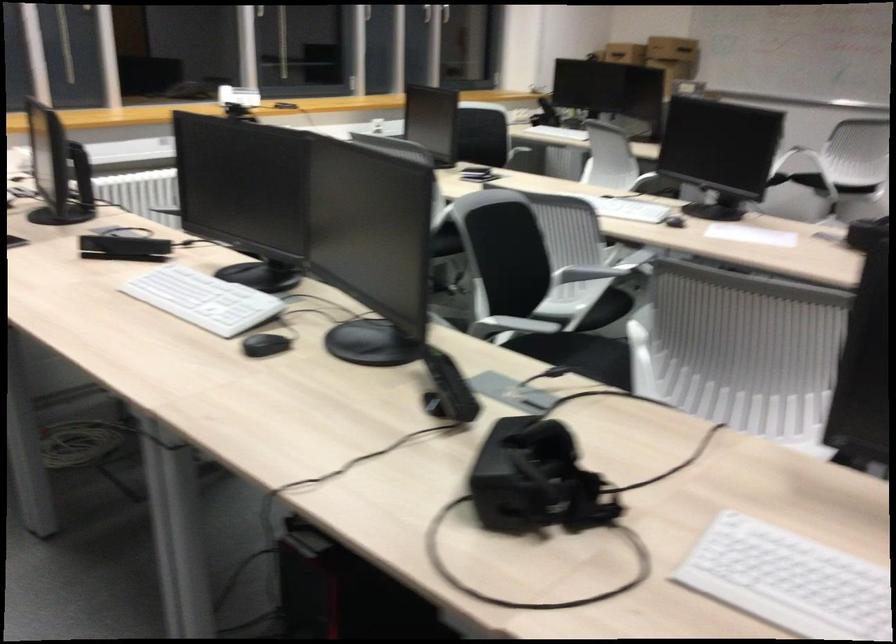
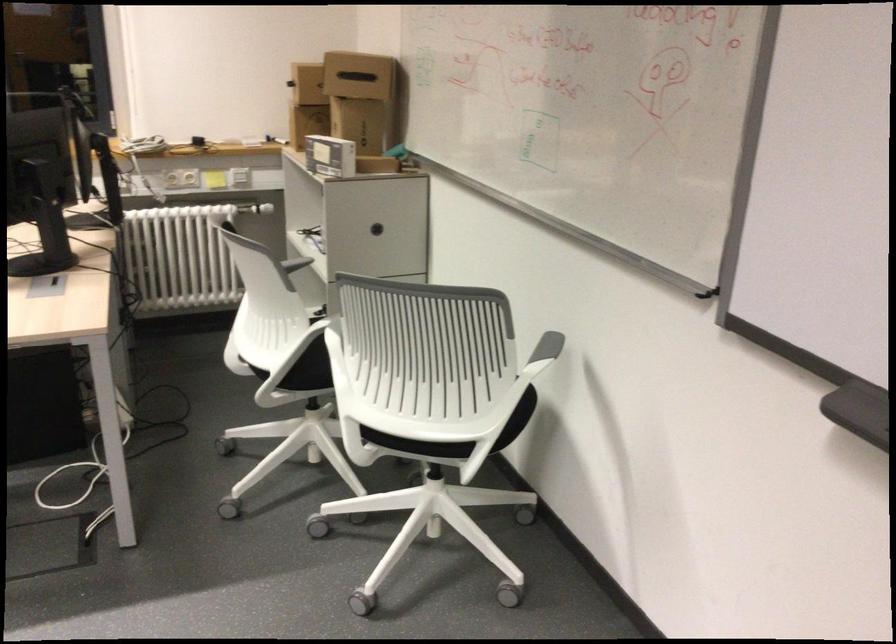
Question: I am providing you with two images of the same scene from different viewpoints. Please identify which objects are invisible in image2.

Choices:
 (A) pink patterned skateboard
 (B) small white box
 (C) whiteboard marker tray
 (D) cardboard box

Answer: (D)